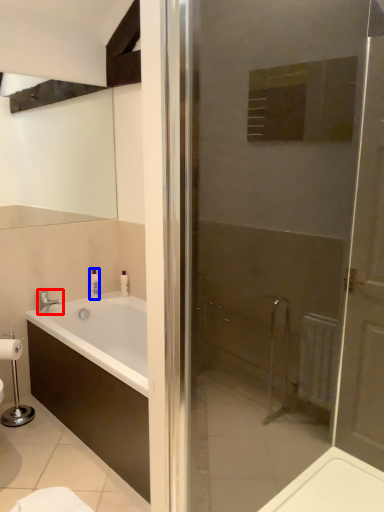
Question: Which object appears farthest to the camera in this image, tap (highlighted by a red box) or toiletry (highlighted by a blue box)?

Choices:
 (A) tap
 (B) toiletry

Answer: (B)